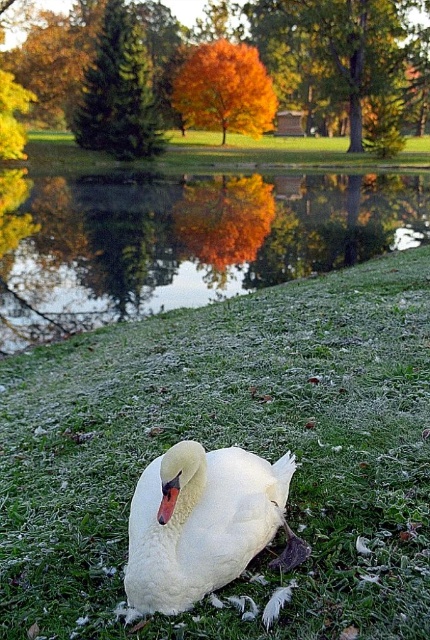
Question: Does glossy reflective water at center appear on the left side of white feathered swan at center?

Choices:
 (A) no
 (B) yes

Answer: (B)

Question: Estimate the real-world distances between objects in this image. Which object is farther from the white feathered swan at center?

Choices:
 (A) white fluffy grass at lower center
 (B) glossy reflective water at center

Answer: (B)

Question: Where is white fluffy grass at lower center located in relation to white feathered swan at center in the image?

Choices:
 (A) below
 (B) above

Answer: (B)

Question: Which of the following is the farthest from the observer?

Choices:
 (A) click(x=132, y=582)
 (B) click(x=108, y=280)

Answer: (B)

Question: Observing the image, what is the correct spatial positioning of white fluffy grass at lower center in reference to glossy reflective water at center?

Choices:
 (A) right
 (B) left

Answer: (A)

Question: Which of the following is the farthest from the observer?

Choices:
 (A) (98, 266)
 (B) (362, 538)
 (C) (163, 516)

Answer: (A)